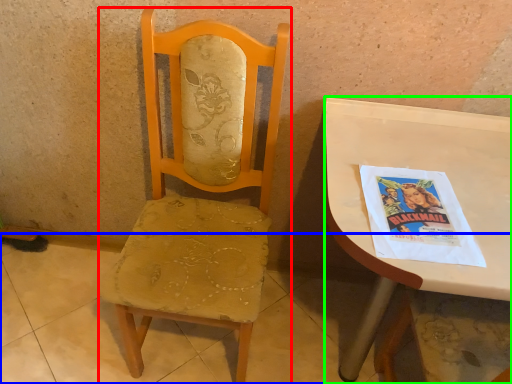
Question: Estimate the real-world distances between objects in this image. Which object is farther from chair (highlighted by a red box), concrete (highlighted by a blue box) or desk (highlighted by a green box)?

Choices:
 (A) concrete
 (B) desk

Answer: (A)